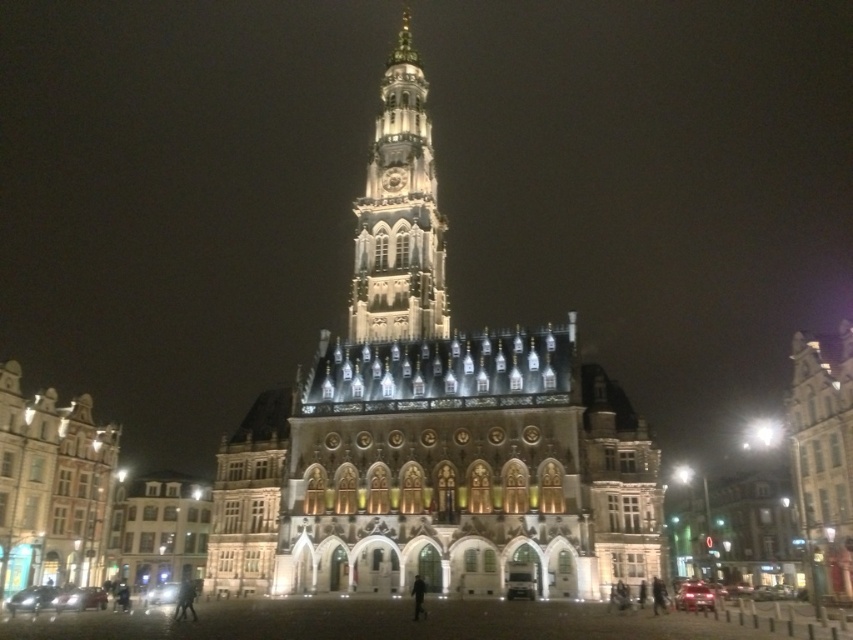
Who is positioned more to the left, polished stone town square at center or illuminated stone church at center?

From the viewer's perspective, polished stone town square at center appears more on the left side.

Which of these two, polished stone town square at center or illuminated stone church at center, stands taller?

With more height is illuminated stone church at center.

What do you see at coordinates (370, 481) in the screenshot? I see `polished stone town square at center` at bounding box center [370, 481].

I want to click on polished stone town square at center, so click(370, 481).

Which is above, illuminated stone church at center or illuminated stone clock tower at center?

Positioned higher is illuminated stone clock tower at center.

Is point (421, 77) positioned before point (409, 33)?

Yes, point (421, 77) is in front of point (409, 33).

Find the location of a particular element. illuminated stone church at center is located at coordinates (432, 428).

From the picture: Can you confirm if polished stone town square at center is positioned below illuminated stone clock tower at center?

Yes, polished stone town square at center is below illuminated stone clock tower at center.

Does polished stone town square at center have a lesser width compared to illuminated stone clock tower at center?

In fact, polished stone town square at center might be wider than illuminated stone clock tower at center.

Does point (456, 500) come in front of point (403, 51)?

Yes, point (456, 500) is closer to viewer.

At what (x,y) coordinates should I click in order to perform the action: click on polished stone town square at center. Please return your answer as a coordinate pair (x, y). Image resolution: width=853 pixels, height=640 pixels. Looking at the image, I should click on (370, 481).